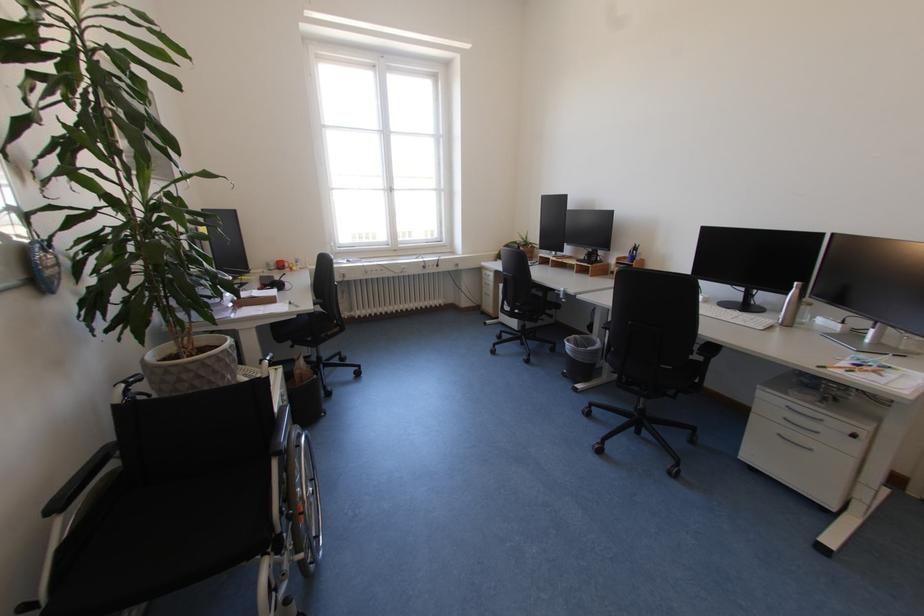
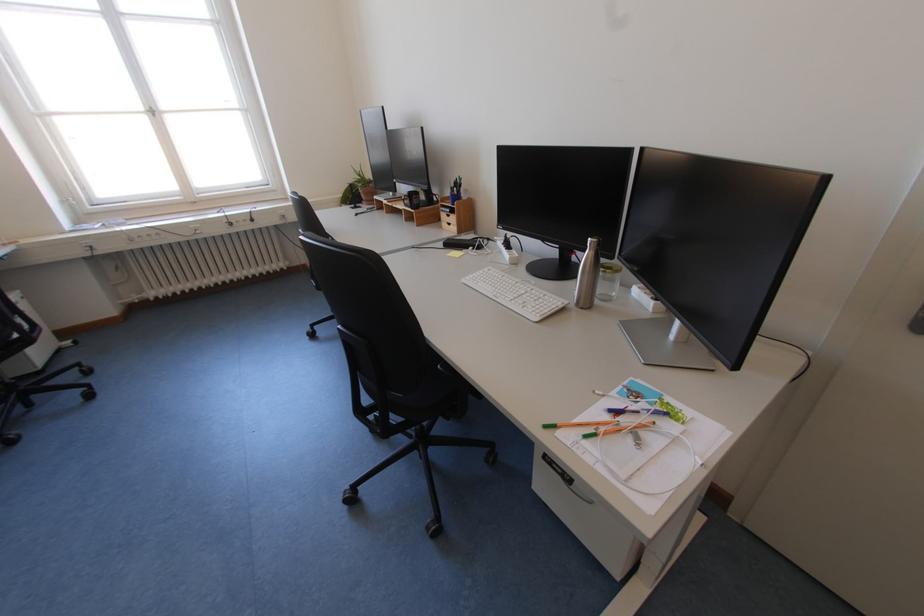
Find the pixel in the second image that matches point (804, 284) in the first image.

(599, 240)